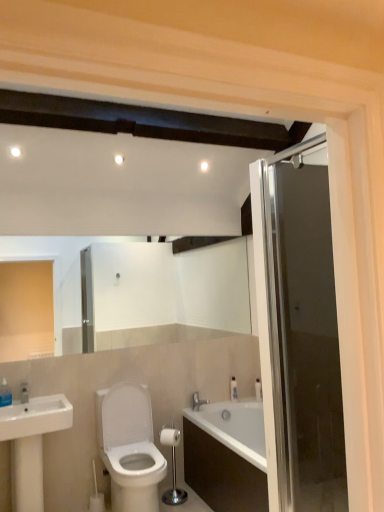
Question: Considering the relative positions of white plastic bottle at right and transparent glass door at right in the image provided, is white plastic bottle at right behind transparent glass door at right?

Choices:
 (A) yes
 (B) no

Answer: (A)

Question: Does white plastic bottle at right have a smaller size compared to transparent glass door at right?

Choices:
 (A) yes
 (B) no

Answer: (A)

Question: Is white plastic bottle at right oriented towards transparent glass door at right?

Choices:
 (A) yes
 (B) no

Answer: (B)

Question: Does white plastic bottle at right lie in front of transparent glass door at right?

Choices:
 (A) no
 (B) yes

Answer: (A)

Question: From a real-world perspective, is white plastic bottle at right on transparent glass door at right?

Choices:
 (A) no
 (B) yes

Answer: (A)

Question: Is white plastic bottle at right facing away from transparent glass door at right?

Choices:
 (A) yes
 (B) no

Answer: (B)

Question: Considering the relative positions of transparent glass door at right and silver metallic faucet at lower center in the image provided, is transparent glass door at right to the left of silver metallic faucet at lower center from the viewer's perspective?

Choices:
 (A) no
 (B) yes

Answer: (A)

Question: Can you confirm if transparent glass door at right is shorter than silver metallic faucet at lower center?

Choices:
 (A) no
 (B) yes

Answer: (A)

Question: Could you tell me if transparent glass door at right is turned towards silver metallic faucet at lower center?

Choices:
 (A) yes
 (B) no

Answer: (B)

Question: From a real-world perspective, is transparent glass door at right physically above silver metallic faucet at lower center?

Choices:
 (A) no
 (B) yes

Answer: (B)

Question: Is the depth of transparent glass door at right less than that of silver metallic faucet at lower center?

Choices:
 (A) yes
 (B) no

Answer: (A)

Question: Is transparent glass door at right bigger than silver metallic faucet at lower center?

Choices:
 (A) yes
 (B) no

Answer: (A)

Question: Can you confirm if transparent glass door at right is smaller than white matte toilet paper at center?

Choices:
 (A) no
 (B) yes

Answer: (A)